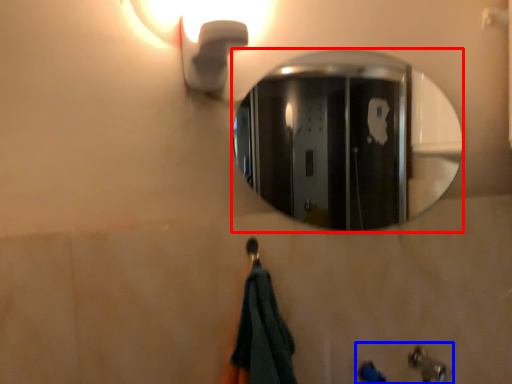
Question: Which point is closer to the camera, mirror (highlighted by a red box) or sink (highlighted by a blue box)?

Choices:
 (A) mirror
 (B) sink

Answer: (B)